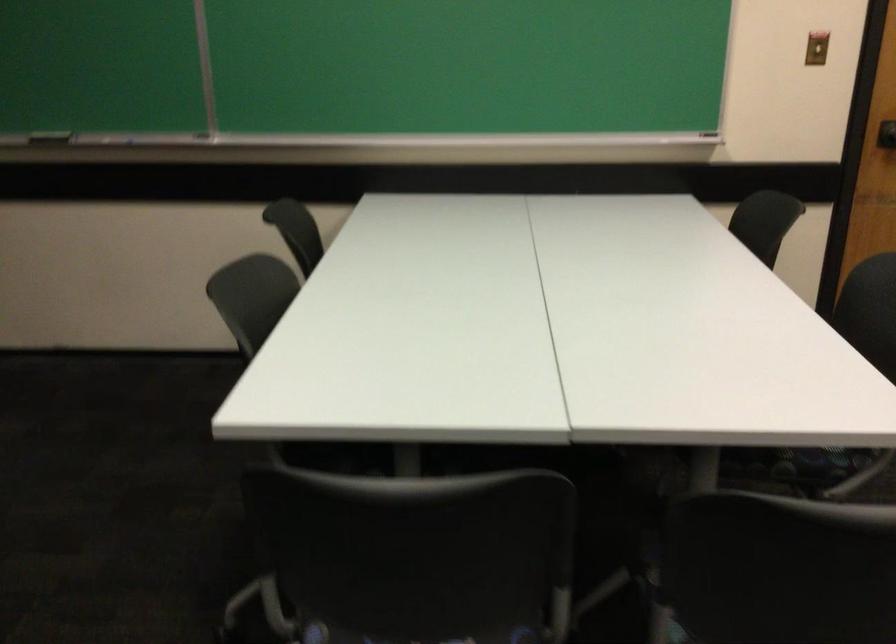
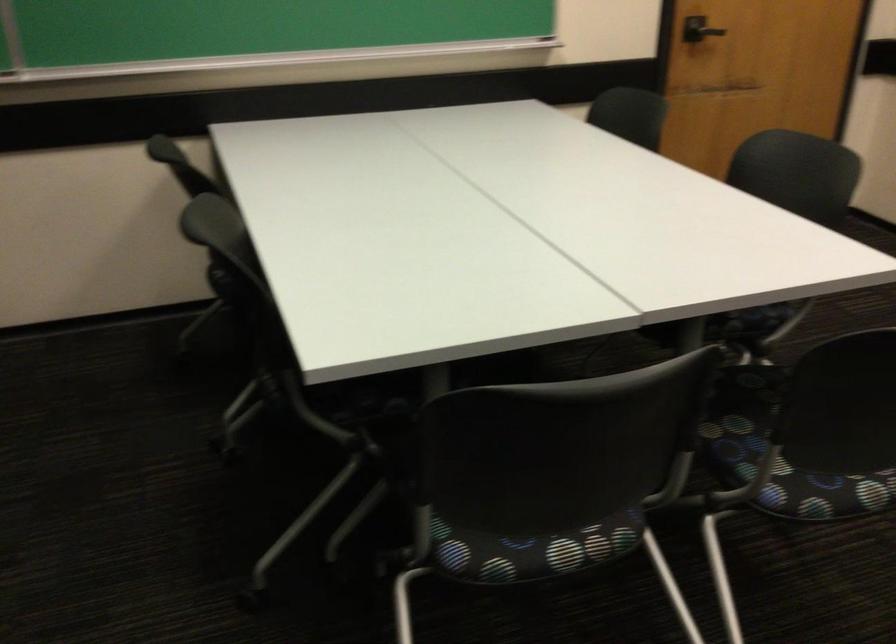
The point at (776, 469) is marked in the first image. Where is the corresponding point in the second image?

(734, 328)